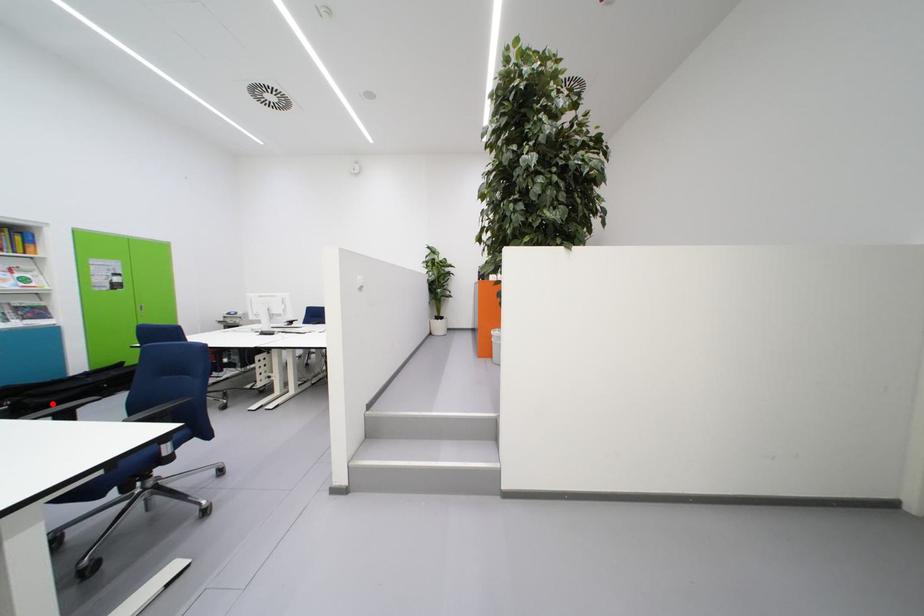
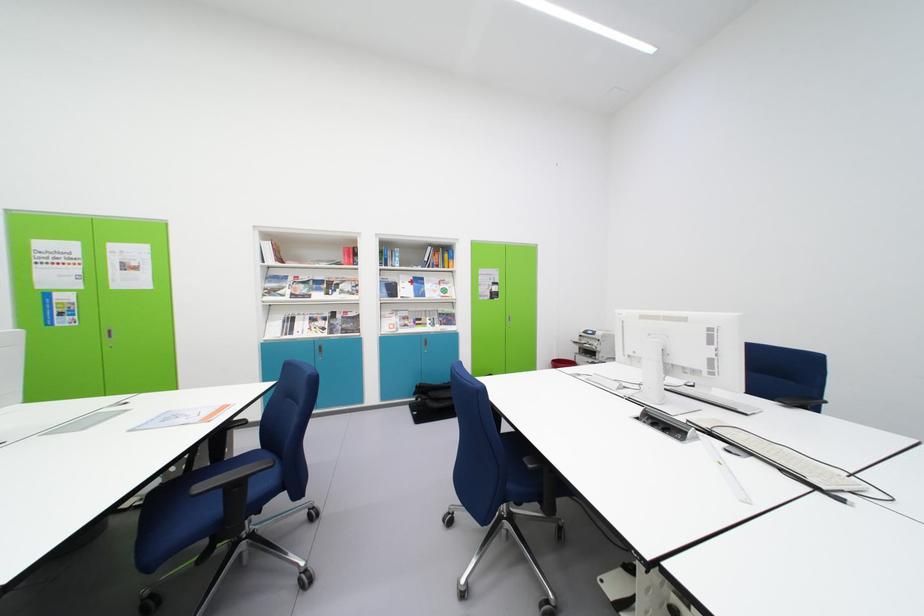
Question: I am providing you with two images of the same scene from different viewpoints. In image1, a red point is highlighted. Considering the same 3D point in image2, which of the following is correct?

Choices:
 (A) It is closer
 (B) It is farther

Answer: (A)